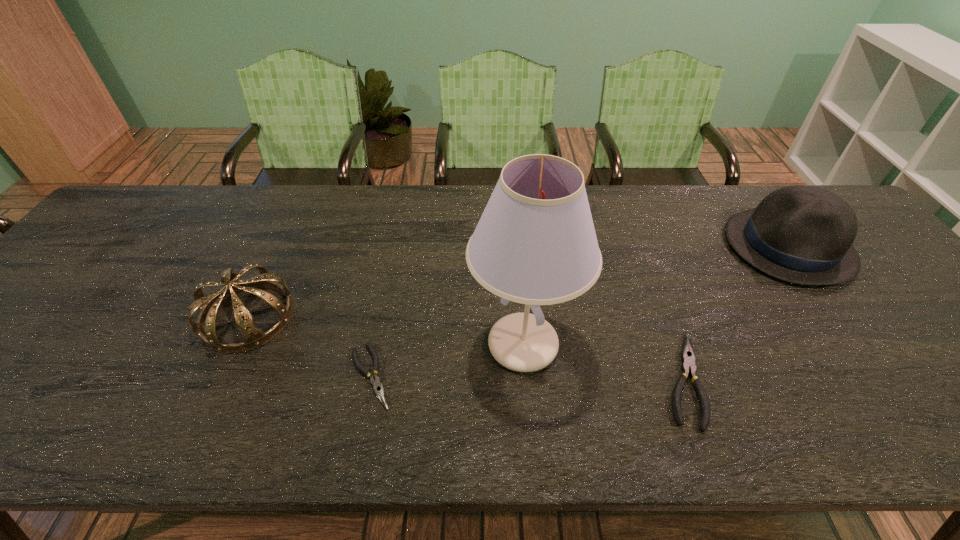
At what (x,y) coordinates should I click in order to perform the action: click on the fourth object from right to left. Please return your answer as a coordinate pair (x, y). Looking at the image, I should click on (378, 388).

The width and height of the screenshot is (960, 540). I want to click on the left pliers, so click(378, 388).

Locate an element on the screen. The height and width of the screenshot is (540, 960). the second object from right to left is located at coordinates (688, 357).

Identify the location of the fourth tallest object. (688, 357).

Where is `the leftmost object`? The width and height of the screenshot is (960, 540). the leftmost object is located at coordinates [x=253, y=337].

The height and width of the screenshot is (540, 960). I want to click on the third tallest object, so pos(253,337).

Find the location of `the rightmost object`. the rightmost object is located at coordinates (801, 234).

Locate an element on the screen. Image resolution: width=960 pixels, height=540 pixels. lampshade is located at coordinates (535, 244).

At what (x,y) coordinates should I click in order to perform the action: click on the tallest object. Please return your answer as a coordinate pair (x, y). This screenshot has height=540, width=960. Looking at the image, I should click on (535, 244).

Locate an element on the screen. The width and height of the screenshot is (960, 540). vacant space situated on the right of the fourth object from right to left is located at coordinates (547, 376).